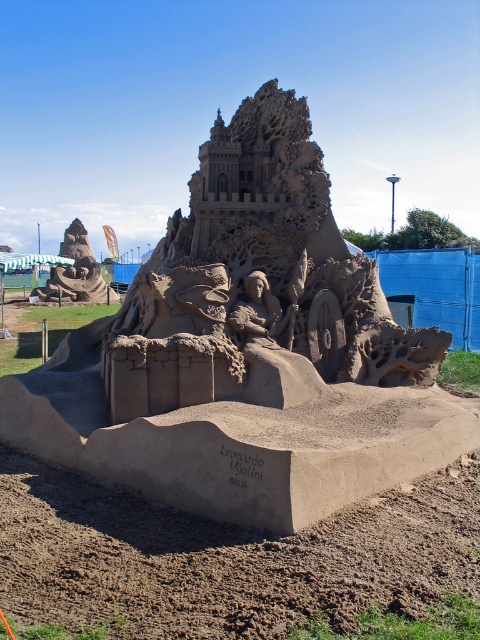
Question: Can you confirm if natural sand sandcastle at center is smaller than sandcastle at left?

Choices:
 (A) yes
 (B) no

Answer: (A)

Question: Does natural sand sandcastle at center appear on the left side of sandcastle at left?

Choices:
 (A) no
 (B) yes

Answer: (A)

Question: Can you confirm if natural sand sandcastle at center is thinner than sandcastle at left?

Choices:
 (A) yes
 (B) no

Answer: (B)

Question: Which of the following is the farthest from the observer?

Choices:
 (A) natural sand sandcastle at center
 (B) sandcastle at left

Answer: (B)